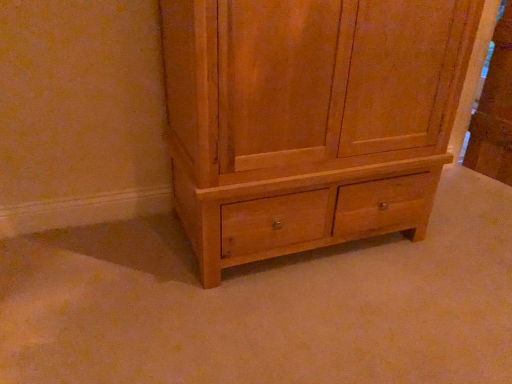
What do you see at coordinates (308, 119) in the screenshot? The image size is (512, 384). I see `natural wood cabinet at center` at bounding box center [308, 119].

Find the location of a particular element. The width and height of the screenshot is (512, 384). natural wood cabinet at center is located at coordinates (308, 119).

The height and width of the screenshot is (384, 512). I want to click on natural wood cabinet at center, so click(x=308, y=119).